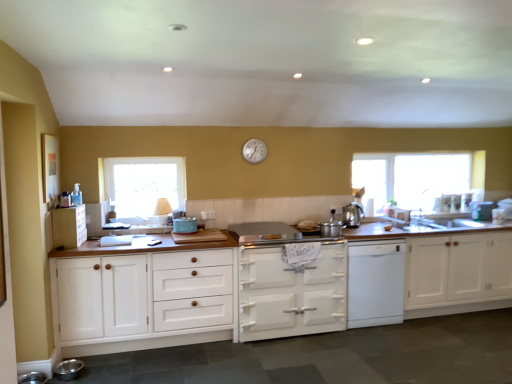
Question: Is clear glass window at left, marked as the second window in a right-to-left arrangement, oriented away from white glossy stove at center, placed as the 2th cabinetry when sorted from right to left?

Choices:
 (A) yes
 (B) no

Answer: (B)

Question: From the image's perspective, is clear glass window at left, marked as the 1th window in a front-to-back arrangement, under white glossy stove at center, placed as the 2th cabinetry when sorted from right to left?

Choices:
 (A) yes
 (B) no

Answer: (B)

Question: Can you see clear glass window at left, which appears as the 1th window when viewed from the left, touching white glossy stove at center, placed as the 2th cabinetry when sorted from right to left?

Choices:
 (A) yes
 (B) no

Answer: (B)

Question: Could you tell me if clear glass window at left, which appears as the 1th window when viewed from the left, is facing white glossy stove at center, placed as the 2th cabinetry when sorted from right to left?

Choices:
 (A) no
 (B) yes

Answer: (A)

Question: Considering the relative positions of clear glass window at left, which appears as the 1th window when viewed from the left, and white glossy stove at center, placed as the 2th cabinetry when sorted from right to left, in the image provided, is clear glass window at left, which appears as the 1th window when viewed from the left, behind white glossy stove at center, placed as the 2th cabinetry when sorted from right to left,?

Choices:
 (A) yes
 (B) no

Answer: (A)

Question: Looking at the image, does white matte dishwasher at center seem bigger or smaller compared to polished stainless steel kettle at center right, the second appliance from the right?

Choices:
 (A) big
 (B) small

Answer: (A)

Question: From the image's perspective, is white matte dishwasher at center positioned above or below polished stainless steel kettle at center right, positioned as the 4th appliance in front-to-back order?

Choices:
 (A) below
 (B) above

Answer: (A)

Question: Do you think white matte dishwasher at center is within polished stainless steel kettle at center right, acting as the 4th appliance starting from the left, or outside of it?

Choices:
 (A) inside
 (B) outside

Answer: (B)

Question: Is white matte dishwasher at center wider or thinner than polished stainless steel kettle at center right, the fourth appliance ordered from the bottom?

Choices:
 (A) thin
 (B) wide

Answer: (B)

Question: From the image's perspective, is white wood cabinet at left, acting as the 2th cabinetry starting from the left, above or below clear glass window at upper right, which ranks as the 2th window in left-to-right order?

Choices:
 (A) above
 (B) below

Answer: (B)

Question: Relative to clear glass window at upper right, placed as the first window when sorted from right to left, is white wood cabinet at left, acting as the 2th cabinetry starting from the left, in front or behind?

Choices:
 (A) behind
 (B) front

Answer: (B)

Question: In terms of size, does white wood cabinet at left, the third cabinetry positioned from the right, appear bigger or smaller than clear glass window at upper right, which is the second window in front-to-back order?

Choices:
 (A) small
 (B) big

Answer: (B)

Question: Is white wood cabinet at left, acting as the 2th cabinetry starting from the left, situated inside clear glass window at upper right, placed as the first window when sorted from right to left, or outside?

Choices:
 (A) inside
 (B) outside

Answer: (B)

Question: In terms of size, does white glossy stove at center, positioned as the 3th cabinetry in left-to-right order, appear bigger or smaller than white wood cabinet at left, acting as the 2th cabinetry starting from the left?

Choices:
 (A) big
 (B) small

Answer: (B)

Question: Is white glossy stove at center, placed as the 2th cabinetry when sorted from right to left, taller or shorter than white wood cabinet at left, acting as the 2th cabinetry starting from the left?

Choices:
 (A) short
 (B) tall

Answer: (A)